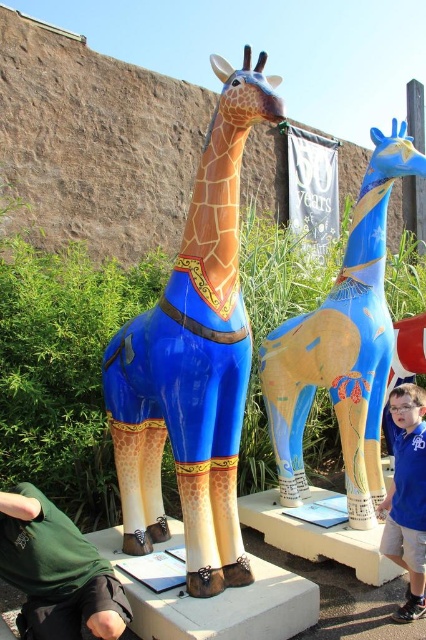
You are standing in front of an outdoor art exhibit and want to take a photo of the blue glossy giraffe at center. If your camera can focus on objects up to 3 meters away, will you need to move closer or farther away to get a clear shot?

The blue glossy giraffe at center is 3.42 meters away from the camera. Since the camera can focus up to 3 meters, you need to move closer to ensure it falls within the focus range.

You are an artist planning to photograph both the glossy painted giraffe at center and the blue fabric shirt at lower right. Since you want to ensure both subjects are in focus, which object should you position closer to the camera to maintain clarity?

The glossy painted giraffe at center is larger in size than the blue fabric shirt at lower right, so positioning the smaller blue fabric shirt at lower right closer to the camera will help maintain clarity for both subjects.